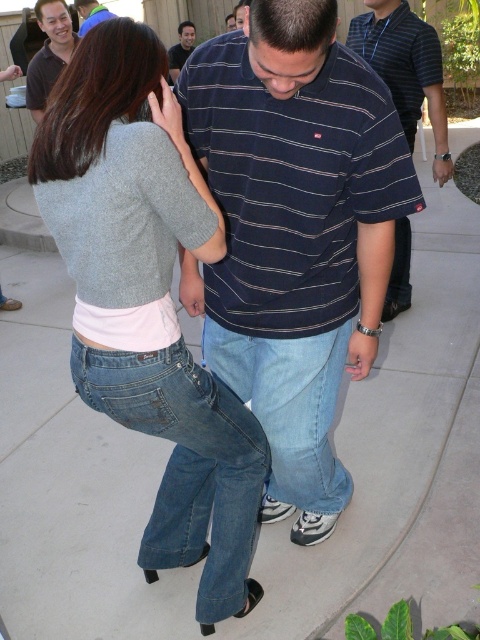
Who is more distant from viewer, (332,344) or (430,60)?

Positioned behind is point (430,60).

Find the location of a particular element. This screenshot has height=640, width=480. light blue denim jeans at center is located at coordinates (288, 406).

You are a GUI agent. You are given a task and a screenshot of the screen. Output one action in this format:
    pyautogui.click(x=<x>, y=<y>)
    Task: Click on the light blue denim jeans at center
    The height and width of the screenshot is (640, 480).
    Given the screenshot: What is the action you would take?
    point(288,406)

Consider the image. Is denim jeans at center below light blue denim jeans at center?

No, denim jeans at center is not below light blue denim jeans at center.

Is point (111, 358) positioned behind point (320, 348)?

No, (111, 358) is closer to viewer.

The image size is (480, 640). Find the location of `denim jeans at center`. denim jeans at center is located at coordinates (148, 300).

Is the position of denim jeans at lower center more distant than that of matte blue shirt at upper center?

No, it is in front of matte blue shirt at upper center.

Does point (168, 541) come behind point (97, 12)?

No, it is in front of (97, 12).

Find the location of a particular element. denim jeans at lower center is located at coordinates (188, 465).